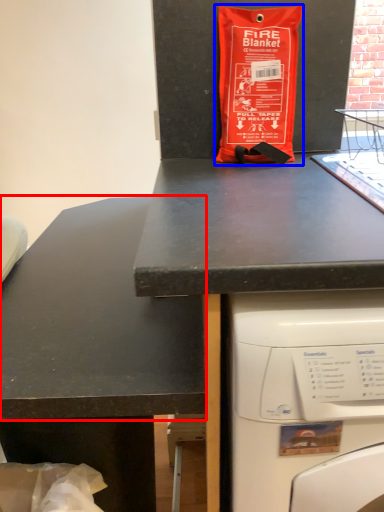
Question: Which point is further to the camera, counter top (highlighted by a red box) or bag (highlighted by a blue box)?

Choices:
 (A) counter top
 (B) bag

Answer: (B)